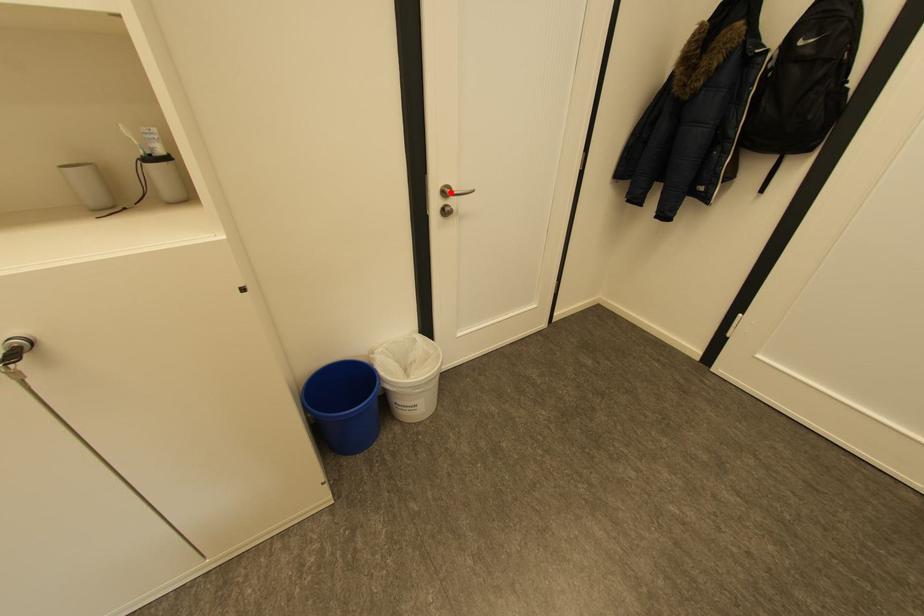
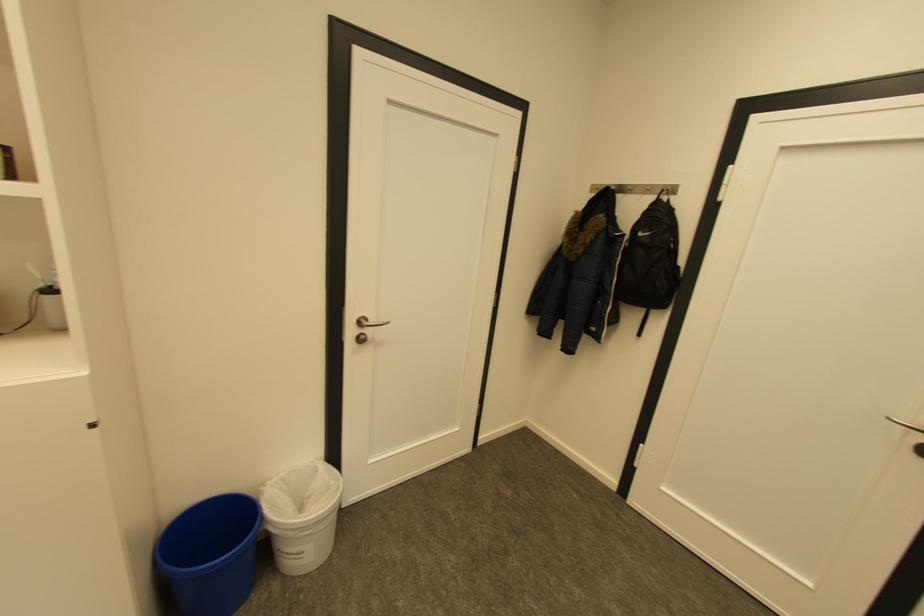
Locate, in the second image, the point that corresponds to the highlighted location in the first image.

(367, 323)